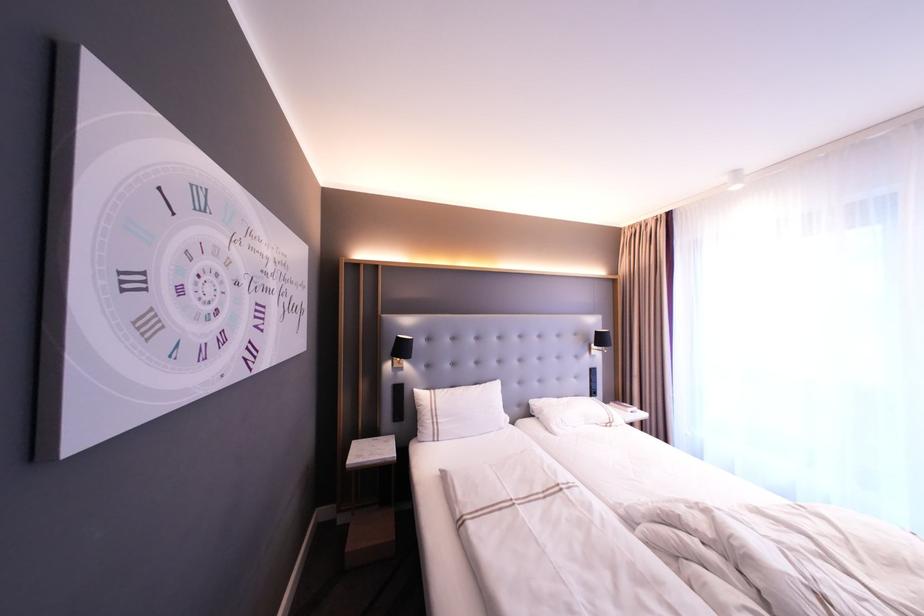
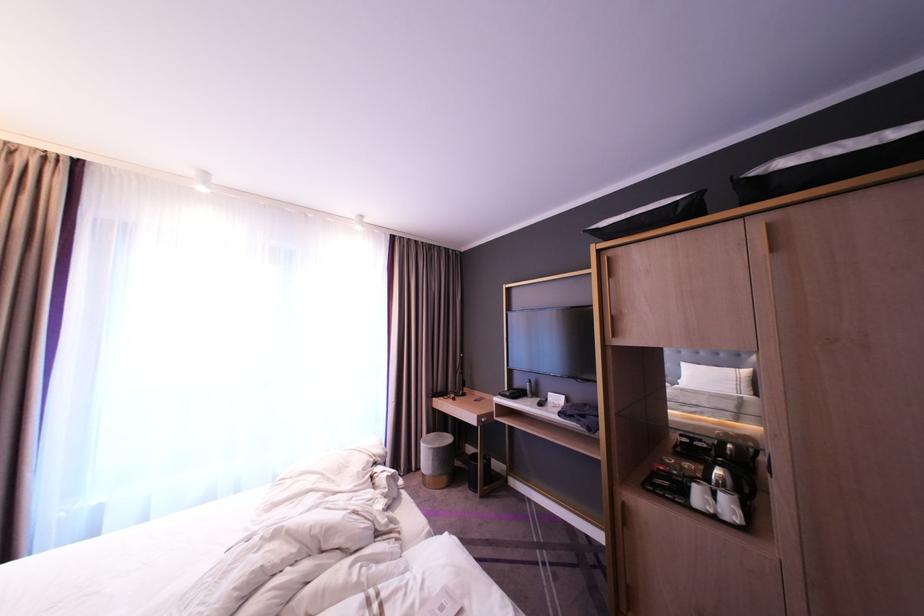
Question: The first image is from the beginning of the video and the second image is from the end. How did the camera likely rotate when shooting the video?

Choices:
 (A) Left
 (B) Right
 (C) Up
 (D) Down

Answer: (B)